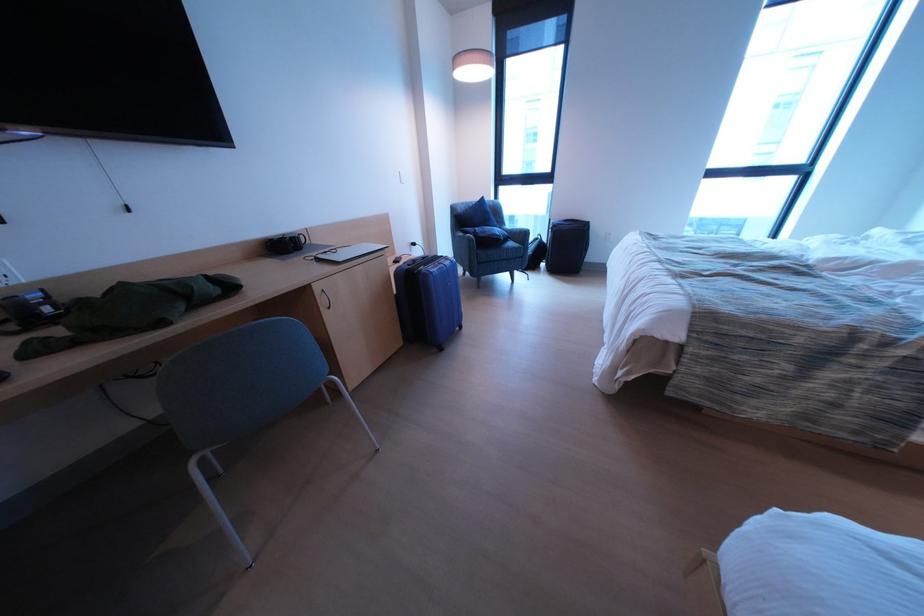
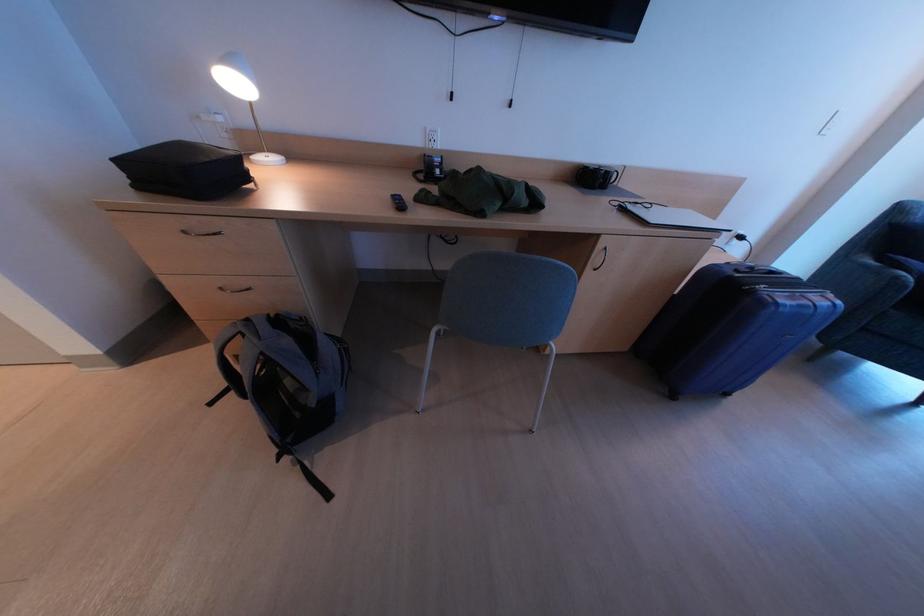
Based on the continuous images, in which direction is the camera rotating?

The camera's rotation is toward left-down.